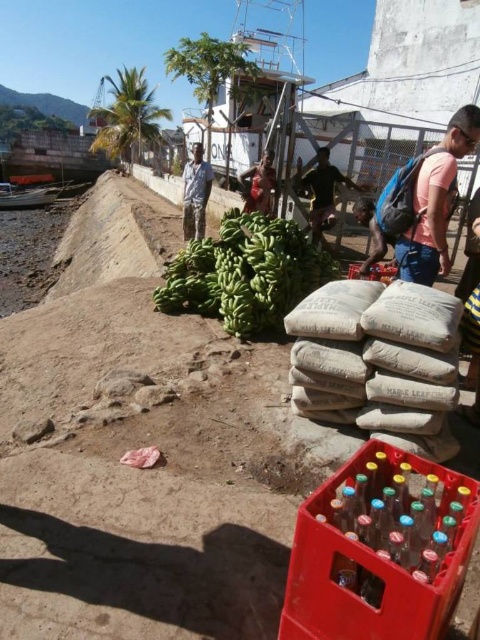
Is camouflage pants at center bigger than dark brown leather backpack at center?

No.

Who is taller, camouflage pants at center or dark brown leather backpack at center?

dark brown leather backpack at center

Describe the element at coordinates (195, 193) in the screenshot. I see `camouflage pants at center` at that location.

Locate an element on the screen. This screenshot has width=480, height=640. camouflage pants at center is located at coordinates (x=195, y=193).

From the picture: Can you confirm if translucent plastic bottles at lower right is positioned to the right of matte blue backpack at center right?

Incorrect, translucent plastic bottles at lower right is not on the right side of matte blue backpack at center right.

Who is more forward, (465, 497) or (400, 234)?

Positioned in front is point (465, 497).

Which is behind, point (361, 529) or point (382, 196)?

The point (382, 196) is more distant.

This screenshot has width=480, height=640. I want to click on translucent plastic bottles at lower right, so click(400, 513).

Is matte blue backpack at center right closer to the viewer compared to dark brown leather jacket at center?

Yes, it is.

Does matte blue backpack at center right have a lesser width compared to dark brown leather jacket at center?

Yes, matte blue backpack at center right is thinner than dark brown leather jacket at center.

This screenshot has width=480, height=640. What do you see at coordinates (423, 204) in the screenshot?
I see `matte blue backpack at center right` at bounding box center [423, 204].

You are a GUI agent. You are given a task and a screenshot of the screen. Output one action in this format:
    pyautogui.click(x=<x>, y=<y>)
    Task: Click on the matte blue backpack at center right
    The width and height of the screenshot is (480, 640).
    Given the screenshot: What is the action you would take?
    pyautogui.click(x=423, y=204)